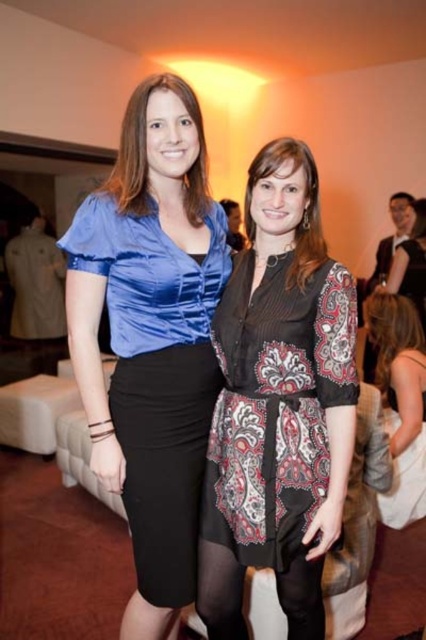
Is paisley-patterned dress at center shorter than white satin dress at lower right?

No, paisley-patterned dress at center is not shorter than white satin dress at lower right.

How far apart are paisley-patterned dress at center and white satin dress at lower right?

They are 1.21 meters apart.

At what (x,y) coordinates should I click in order to perform the action: click on paisley-patterned dress at center. Please return your answer as a coordinate pair (x, y). Looking at the image, I should click on click(279, 404).

Find the location of a particular element. Image resolution: width=426 pixels, height=640 pixels. paisley-patterned dress at center is located at coordinates (279, 404).

Does point (147, 545) come farther from viewer compared to point (408, 448)?

No, it is not.

How much distance is there between shiny blue blouse at left and white satin dress at lower right?

A: shiny blue blouse at left and white satin dress at lower right are 4.72 feet apart from each other.

Locate an element on the screen. shiny blue blouse at left is located at coordinates (150, 337).

Between shiny blue blouse at left and paisley-patterned dress at center, which one is positioned higher?

shiny blue blouse at left

Is point (167, 195) farther from camera compared to point (319, 262)?

Yes, point (167, 195) is farther from viewer.

Is point (187, 109) positioned before point (287, 449)?

No.

Where is `shiny blue blouse at left`? This screenshot has height=640, width=426. shiny blue blouse at left is located at coordinates (150, 337).